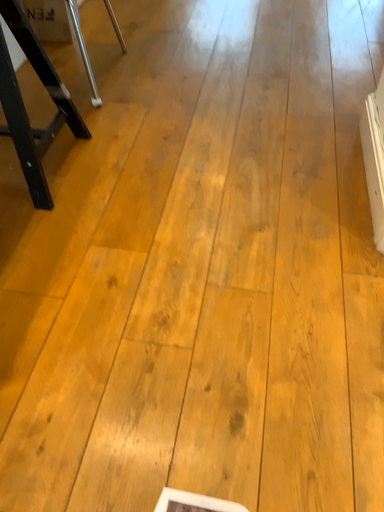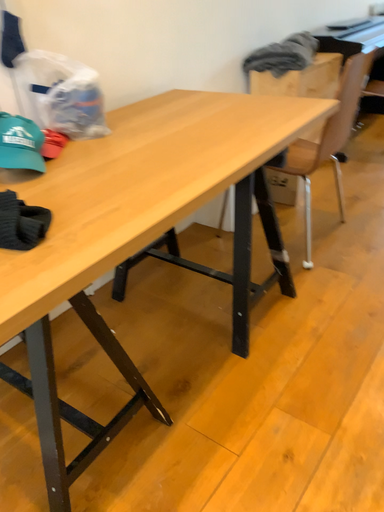
Question: How did the camera likely rotate when shooting the video?

Choices:
 (A) rotated left
 (B) rotated right

Answer: (A)